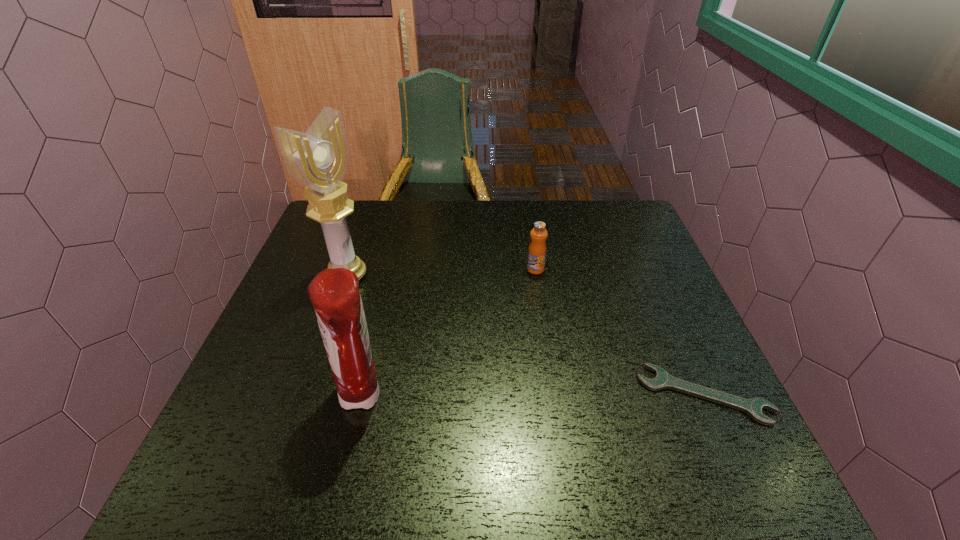
At what (x,y) coordinates should I click in order to perform the action: click on free space in the image that satisfies the following two spatial constraints: 1. on the back side of the condiment; 2. on the right side of the second shortest object. Please return your answer as a coordinate pair (x, y). The image size is (960, 540). Looking at the image, I should click on (392, 269).